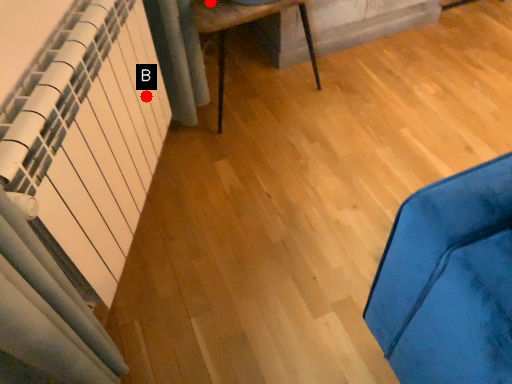
Question: Two points are circled on the image, labeled by A and B beside each circle. Which point appears closest to the camera in this image?

Choices:
 (A) A is closer
 (B) B is closer

Answer: (B)